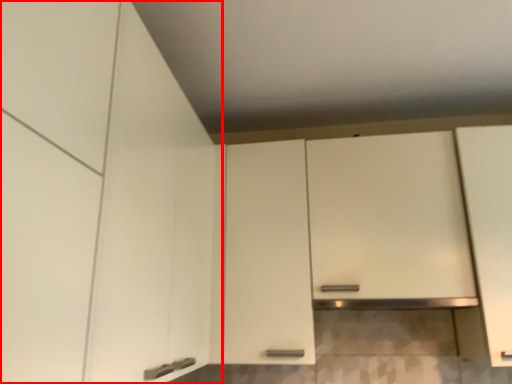
Question: Observing the image, what is the correct spatial positioning of cabinetry (annotated by the red box) in reference to cabinetry?

Choices:
 (A) right
 (B) left

Answer: (B)